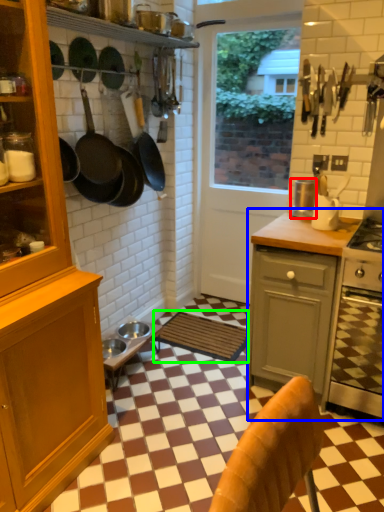
Question: Which object is the farthest from kitchen appliance (highlighted by a red box)? Choose among these: countertop (highlighted by a blue box) or mat (highlighted by a green box).

Choices:
 (A) countertop
 (B) mat

Answer: (B)